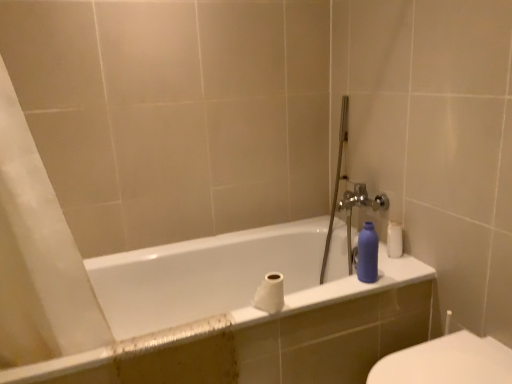
Question: Does white glossy bathtub at center have a greater height compared to white glossy toilet at lower right?

Choices:
 (A) no
 (B) yes

Answer: (B)

Question: Is white glossy bathtub at center oriented towards white glossy toilet at lower right?

Choices:
 (A) yes
 (B) no

Answer: (A)

Question: Can you confirm if white glossy bathtub at center is wider than white glossy toilet at lower right?

Choices:
 (A) yes
 (B) no

Answer: (A)

Question: Can you confirm if white glossy bathtub at center is shorter than white glossy toilet at lower right?

Choices:
 (A) yes
 (B) no

Answer: (B)

Question: From the image's perspective, would you say white glossy bathtub at center is shown under white glossy toilet at lower right?

Choices:
 (A) no
 (B) yes

Answer: (A)

Question: Does point (x=489, y=362) appear closer or farther from the camera than point (x=283, y=243)?

Choices:
 (A) farther
 (B) closer

Answer: (B)

Question: From a real-world perspective, is white glossy toilet at lower right above or below white glossy bathtub at center?

Choices:
 (A) above
 (B) below

Answer: (A)

Question: From the image's perspective, relative to white glossy bathtub at center, is white glossy toilet at lower right above or below?

Choices:
 (A) below
 (B) above

Answer: (A)

Question: Considering their positions, is white glossy toilet at lower right located in front of or behind white glossy bathtub at center?

Choices:
 (A) front
 (B) behind

Answer: (A)

Question: Would you say white glossy bathtub at center is inside or outside white matte toilet paper at center?

Choices:
 (A) outside
 (B) inside

Answer: (A)

Question: In the image, is white glossy bathtub at center on the left side or the right side of white matte toilet paper at center?

Choices:
 (A) right
 (B) left

Answer: (B)

Question: Based on their sizes in the image, would you say white glossy bathtub at center is bigger or smaller than white matte toilet paper at center?

Choices:
 (A) small
 (B) big

Answer: (B)

Question: Looking at their shapes, would you say white glossy bathtub at center is wider or thinner than white matte toilet paper at center?

Choices:
 (A) thin
 (B) wide

Answer: (B)

Question: Does point coord(267,274) appear closer or farther from the camera than point coord(436,340)?

Choices:
 (A) farther
 (B) closer

Answer: (A)

Question: From a real-world perspective, is white matte toilet paper at center physically located above or below white glossy toilet at lower right?

Choices:
 (A) below
 (B) above

Answer: (B)